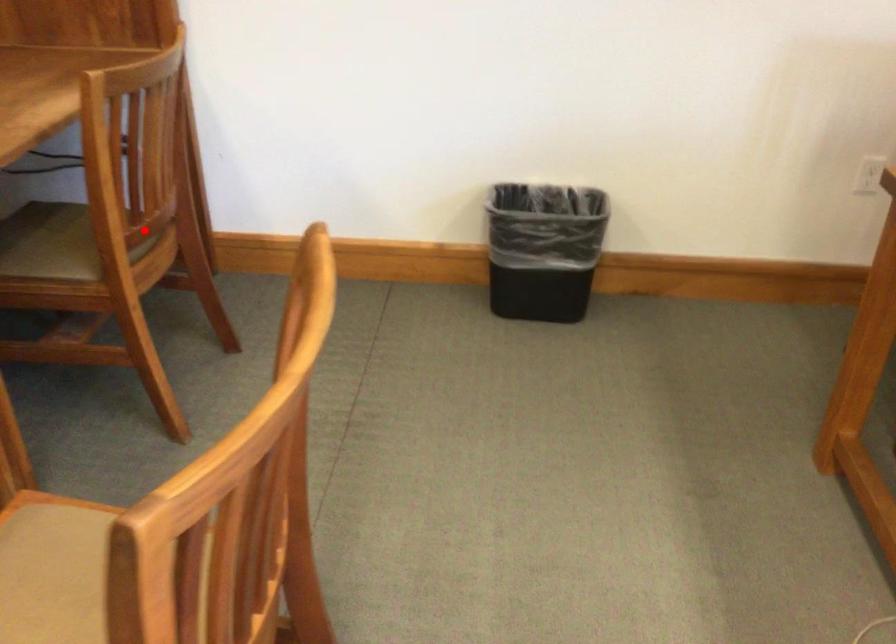
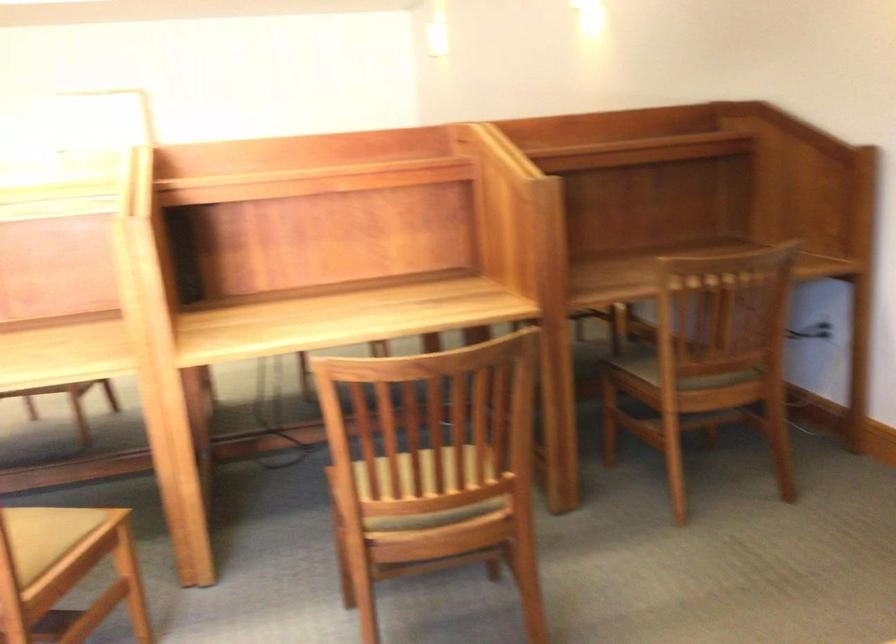
Question: I am providing you with two images of the same scene from different viewpoints. In image1, a red point is highlighted. Considering the same 3D point in image2, which of the following is correct?

Choices:
 (A) It is closer
 (B) It is farther

Answer: (B)